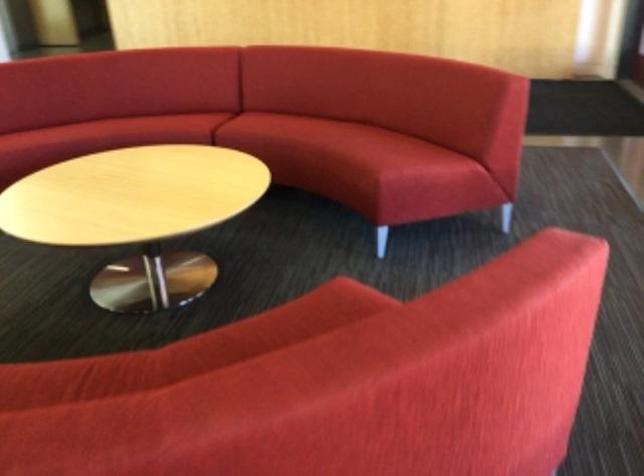
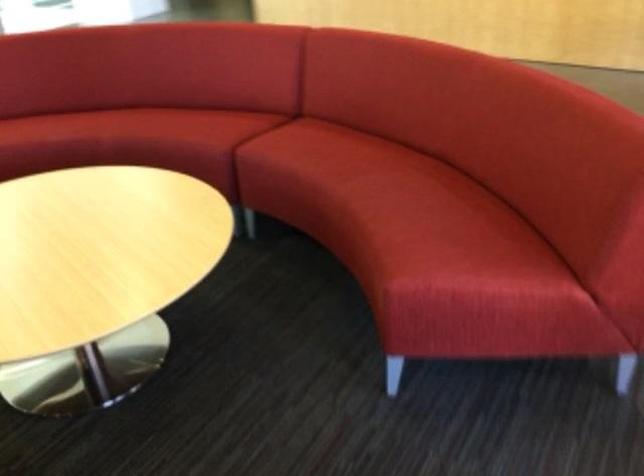
In the second image, find the point that corresponds to (332,136) in the first image.

(370, 186)